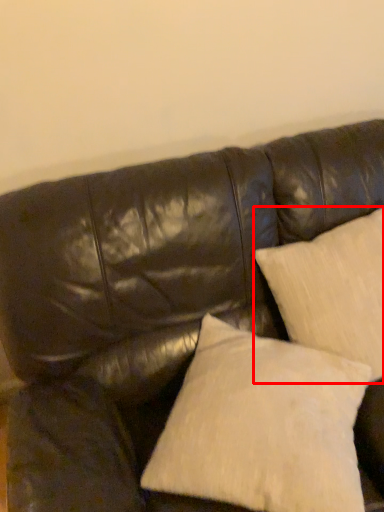
Question: Observing the image, what is the correct spatial positioning of pillow (annotated by the red box) in reference to pillow?

Choices:
 (A) right
 (B) left

Answer: (A)